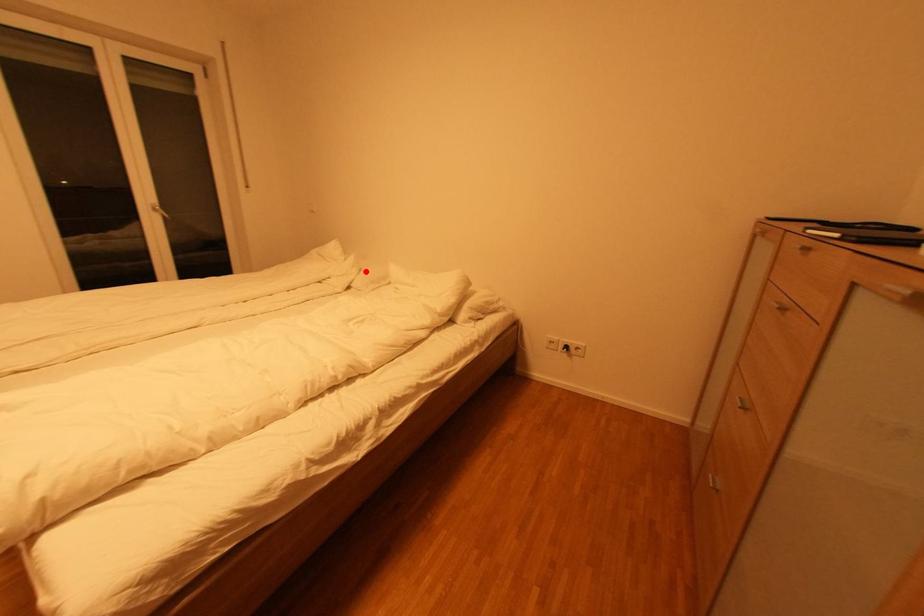
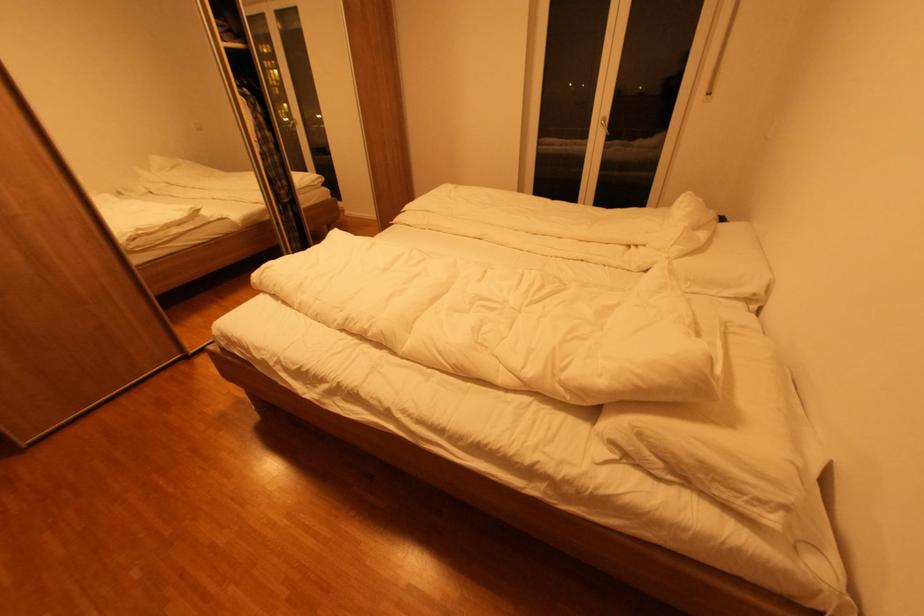
Question: A red point is marked in image1. In image2, is the corresponding 3D point closer to the camera or farther? Reply with the corresponding letter.

Choices:
 (A) The corresponding 3D point is closer.
 (B) The corresponding 3D point is farther.

Answer: (B)